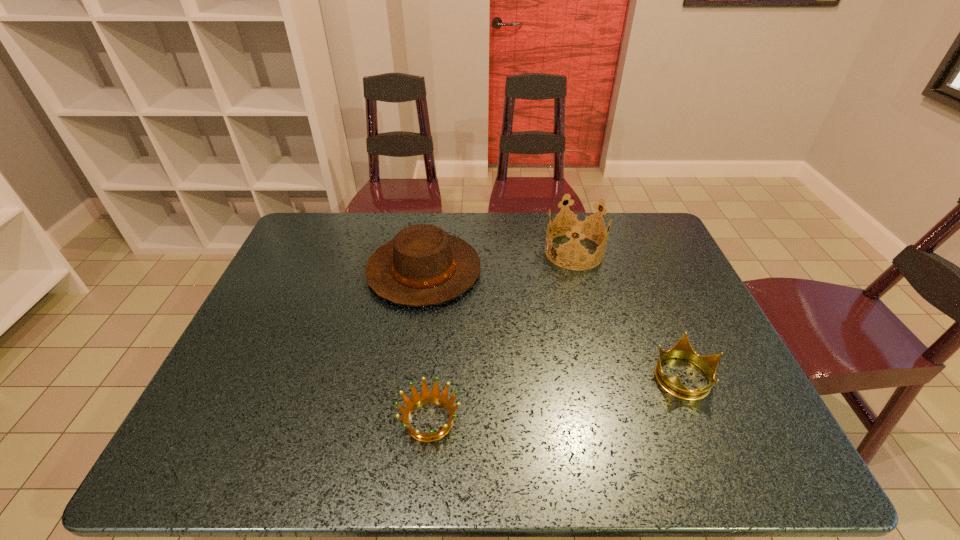
What are the coordinates of `object that is the third closest to the second tallest object` in the screenshot? It's located at (682, 349).

You are a GUI agent. You are given a task and a screenshot of the screen. Output one action in this format:
    pyautogui.click(x=<x>, y=<y>)
    Task: Click on the object that is the closest to the shortest crown
    The height and width of the screenshot is (540, 960).
    Given the screenshot: What is the action you would take?
    pyautogui.click(x=422, y=266)

Identify which crown is the second nearest to the third tallest object. Please provide its 2D coordinates. Your answer should be formatted as a tuple, i.e. [(x, y)], where the tuple contains the x and y coordinates of a point satisfying the conditions above.

[(426, 397)]

Point out which crown is positioned as the nearest to the tallest crown. Please provide its 2D coordinates. Your answer should be formatted as a tuple, i.e. [(x, y)], where the tuple contains the x and y coordinates of a point satisfying the conditions above.

[(682, 349)]

Locate an element on the screen. The height and width of the screenshot is (540, 960). vacant space that satisfies the following two spatial constraints: 1. on the front side of the third shortest object; 2. on the right side of the rightmost crown is located at coordinates (409, 376).

Image resolution: width=960 pixels, height=540 pixels. I want to click on vacant area that satisfies the following two spatial constraints: 1. on the back side of the cowboy hat; 2. on the right side of the second crown from left to right, so click(x=427, y=252).

You are a GUI agent. You are given a task and a screenshot of the screen. Output one action in this format:
    pyautogui.click(x=<x>, y=<y>)
    Task: Click on the vacant region that satisfies the following two spatial constraints: 1. on the front side of the rightmost crown; 2. on the right side of the third shortest object
    
    Given the screenshot: What is the action you would take?
    pyautogui.click(x=409, y=376)